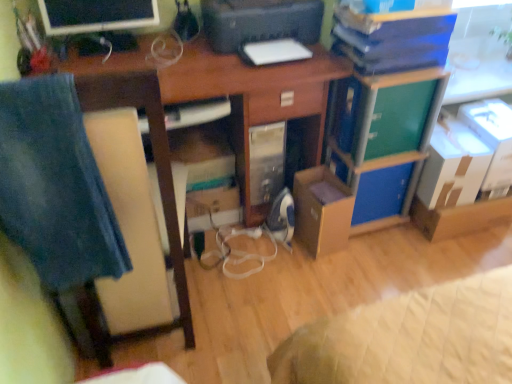
The image size is (512, 384). Identify the location of vacant area on top of white cardboard box at right, the third cardboard box in the right-to-left sequence (from a real-world perspective). (456, 131).